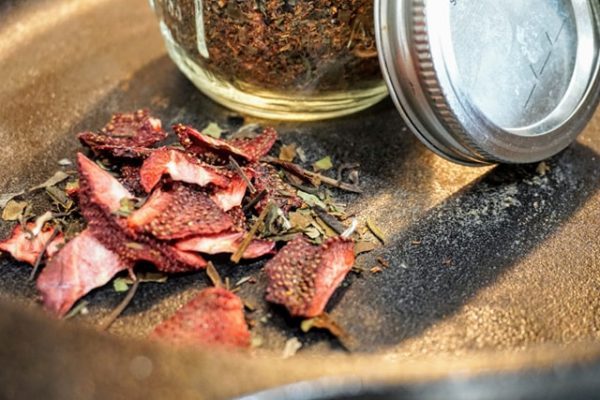
This screenshot has width=600, height=400. Identify the location of silver jar lid. (531, 51).